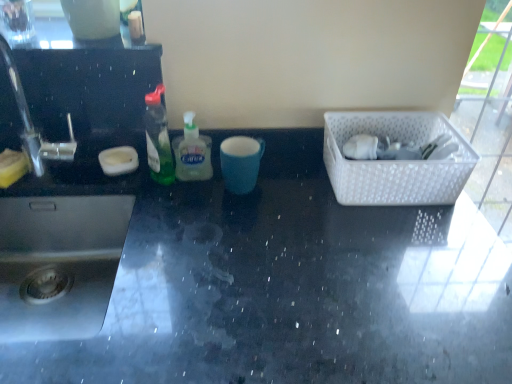
Where is `free space above black glossy countertop at center (from a real-world perspective)`? The image size is (512, 384). free space above black glossy countertop at center (from a real-world perspective) is located at coordinates (260, 243).